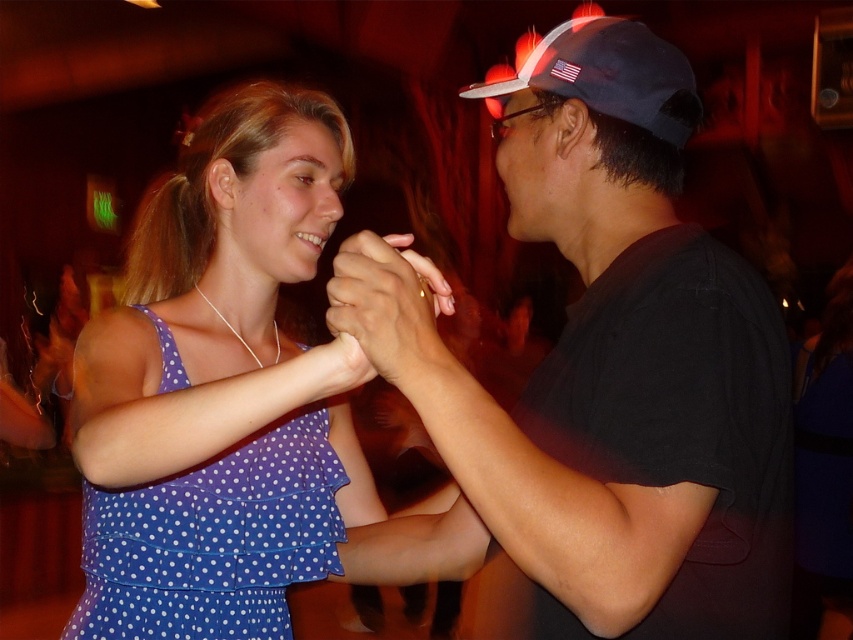
You are a photographer at the event and want to capture a photo where the black matte shirt at center is visible without being blocked by the blue polka dot fabric dress at center. Based on their positions, is this possible?

Yes, the black matte shirt at center is located above the blue polka dot fabric dress at center, so it should be visible without obstruction.

You are at a party and want to take a photo of both the blue polka dot fabric dress at center and the blue fabric baseball cap at upper right. Which object should you focus on first to ensure both are in the frame?

You should focus on the blue polka dot fabric dress at center first because it is positioned under the blue fabric baseball cap at upper right, so adjusting the frame to include the lower object ensures the upper one is also captured.

You are a photographer at the event and want to capture a photo of the black matte shirt at center. Where should you aim your camera to ensure it is centered in the frame?

You should aim your camera at point coordinates of (598, 380) to center the black matte shirt at center in the frame.